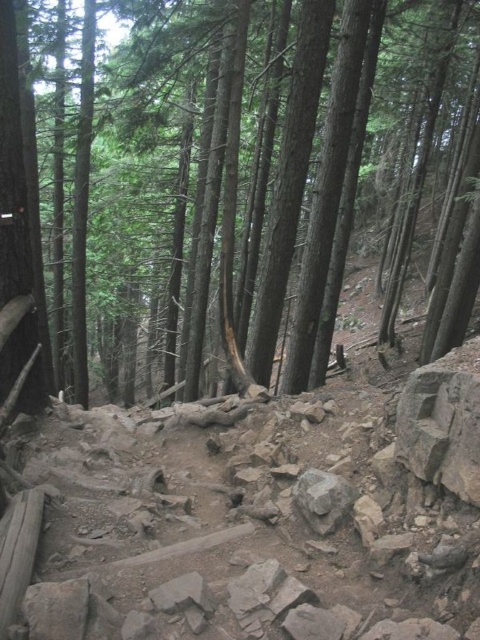
Which of these two, brown rough tree at center or gray rough rock at center, stands taller?

Standing taller between the two is brown rough tree at center.

Can you confirm if brown rough tree at center is shorter than gray rough rock at center?

Incorrect, brown rough tree at center's height does not fall short of gray rough rock at center's.

The image size is (480, 640). Describe the element at coordinates (302, 198) in the screenshot. I see `brown rough tree at center` at that location.

Where is `brown rough tree at center`? The height and width of the screenshot is (640, 480). brown rough tree at center is located at coordinates (302, 198).